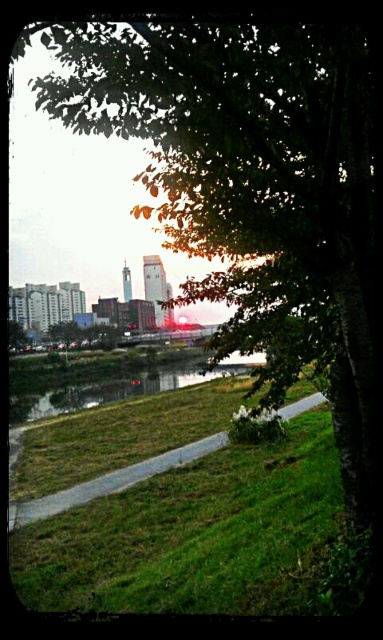
Question: Is green grass at lower left positioned before green grassy river at lower center?

Choices:
 (A) yes
 (B) no

Answer: (A)

Question: Which of the following is the closest to the observer?

Choices:
 (A) green grass at lower left
 (B) green grassy river at lower center
 (C) green leafy tree at lower left

Answer: (A)

Question: Where is green grassy river at lower center located in relation to green leafy tree at lower left in the image?

Choices:
 (A) right
 (B) left

Answer: (A)

Question: Based on their relative distances, which object is nearer to the green grassy river at lower center?

Choices:
 (A) green grass at lower left
 (B) green leafy tree at lower left

Answer: (B)

Question: Does green grass at lower left appear on the right side of green grassy river at lower center?

Choices:
 (A) yes
 (B) no

Answer: (B)

Question: Among these points, which one is farthest from the camera?

Choices:
 (A) (170, 374)
 (B) (18, 340)
 (C) (88, 566)

Answer: (B)